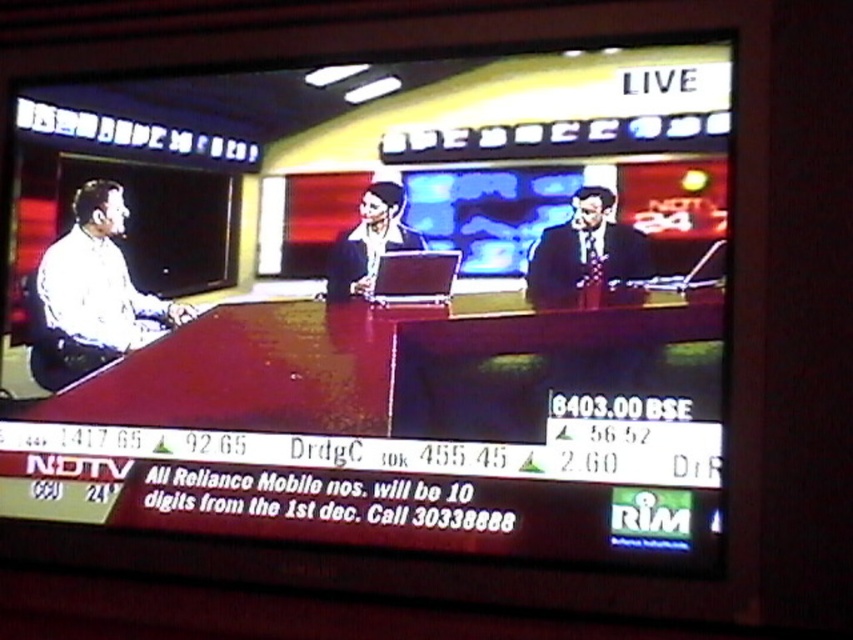
Measure the distance between dark suit at center and dark blue suit at center.

A distance of 16.40 inches exists between dark suit at center and dark blue suit at center.

This screenshot has width=853, height=640. Find the location of `dark suit at center`. dark suit at center is located at coordinates (585, 253).

Consider the image. Can you confirm if matte wooden desk at center is shorter than dark blue suit at center?

No.

In the scene shown: Between matte wooden desk at center and dark blue suit at center, which one appears on the right side from the viewer's perspective?

dark blue suit at center is more to the right.

Which is in front, point (676, 326) or point (347, 285)?

Point (676, 326) is more forward.

Identify the location of matte wooden desk at center. The height and width of the screenshot is (640, 853). (372, 308).

Between point (119, 218) and point (358, 291), which one is positioned in front?

Point (358, 291) is in front.

What do you see at coordinates (91, 294) in the screenshot?
I see `matte white shirt at left` at bounding box center [91, 294].

The height and width of the screenshot is (640, 853). I want to click on matte white shirt at left, so click(91, 294).